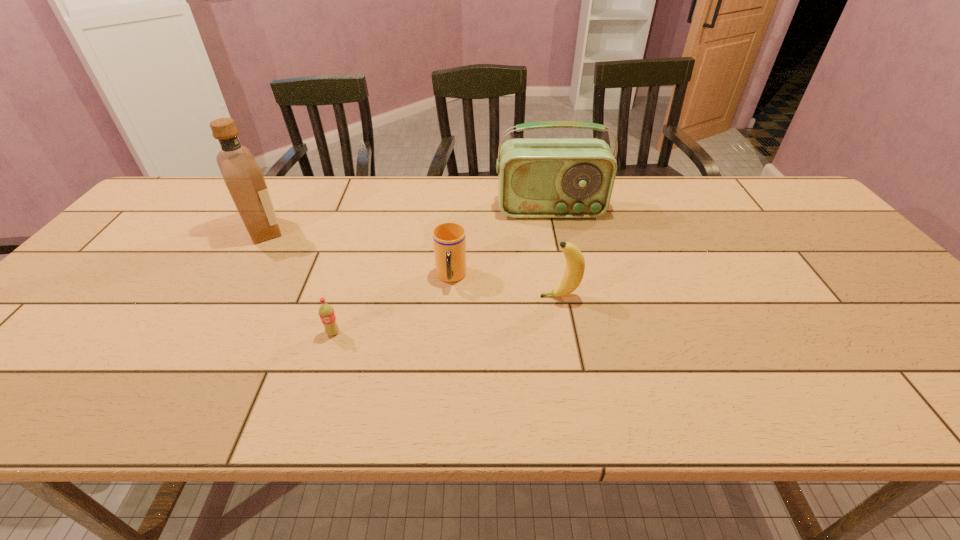
At what (x,y) coordinates should I click in order to perform the action: click on vacant space located 0.290m from the stem of the banana. Please return your answer as a coordinate pair (x, y). The image size is (960, 540). Looking at the image, I should click on (421, 296).

You are a GUI agent. You are given a task and a screenshot of the screen. Output one action in this format:
    pyautogui.click(x=<x>, y=<y>)
    Task: Click on the vacant position located 0.140m from the stem of the banana
    The image size is (960, 540).
    Given the screenshot: What is the action you would take?
    pyautogui.click(x=483, y=296)

Find the location of `vacant space situated 0.380m from the stem of the banana`. vacant space situated 0.380m from the stem of the banana is located at coordinates (x=384, y=296).

What are the coordinates of `free location located on the side of the fourth tallest object with the handle` in the screenshot? It's located at (443, 386).

The image size is (960, 540). What are the coordinates of `free space located on the left of the nearest object` in the screenshot? It's located at (210, 333).

Where is `liquor that is at the far edge`? The image size is (960, 540). liquor that is at the far edge is located at coordinates (244, 179).

This screenshot has height=540, width=960. What are the coordinates of `radio receiver located at the far edge` in the screenshot? It's located at coord(537,178).

I want to click on free space at the far edge, so click(x=670, y=180).

I want to click on free region at the near edge of the desktop, so click(384, 380).

Image resolution: width=960 pixels, height=540 pixels. What are the coordinates of `free space at the left edge` in the screenshot? It's located at (137, 233).